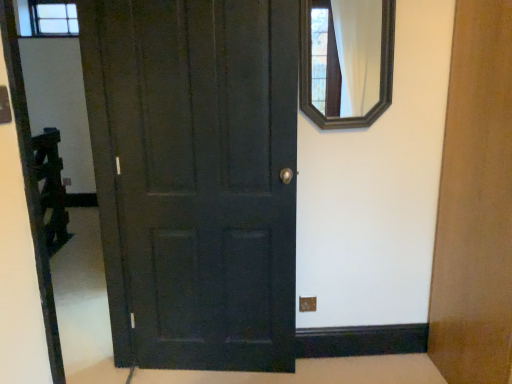
Question: Considering the relative sizes of matte dark wood door at center and wooden-framed mirror at upper right in the image provided, is matte dark wood door at center taller than wooden-framed mirror at upper right?

Choices:
 (A) yes
 (B) no

Answer: (A)

Question: Does matte dark wood door at center turn towards wooden-framed mirror at upper right?

Choices:
 (A) yes
 (B) no

Answer: (B)

Question: Is matte dark wood door at center to the right of wooden-framed mirror at upper right from the viewer's perspective?

Choices:
 (A) no
 (B) yes

Answer: (A)

Question: From the image's perspective, would you say matte dark wood door at center is shown under wooden-framed mirror at upper right?

Choices:
 (A) yes
 (B) no

Answer: (A)

Question: Is matte dark wood door at center positioned far away from wooden-framed mirror at upper right?

Choices:
 (A) no
 (B) yes

Answer: (A)

Question: Does matte dark wood door at center have a lesser height compared to wooden-framed mirror at upper right?

Choices:
 (A) yes
 (B) no

Answer: (B)

Question: Are wooden-framed mirror at upper right and matte dark wood door at center located far from each other?

Choices:
 (A) no
 (B) yes

Answer: (A)

Question: From the image's perspective, is wooden-framed mirror at upper right on matte dark wood door at center?

Choices:
 (A) yes
 (B) no

Answer: (A)

Question: Is wooden-framed mirror at upper right looking in the opposite direction of matte dark wood door at center?

Choices:
 (A) no
 (B) yes

Answer: (A)

Question: Is matte dark wood door at center surrounded by wooden-framed mirror at upper right?

Choices:
 (A) yes
 (B) no

Answer: (B)

Question: Does wooden-framed mirror at upper right appear on the right side of matte dark wood door at center?

Choices:
 (A) yes
 (B) no

Answer: (A)

Question: From the image's perspective, does wooden-framed mirror at upper right appear lower than matte dark wood door at center?

Choices:
 (A) yes
 (B) no

Answer: (B)

Question: From the image's perspective, relative to matte dark wood door at center, is wooden-framed mirror at upper right above or below?

Choices:
 (A) below
 (B) above

Answer: (B)